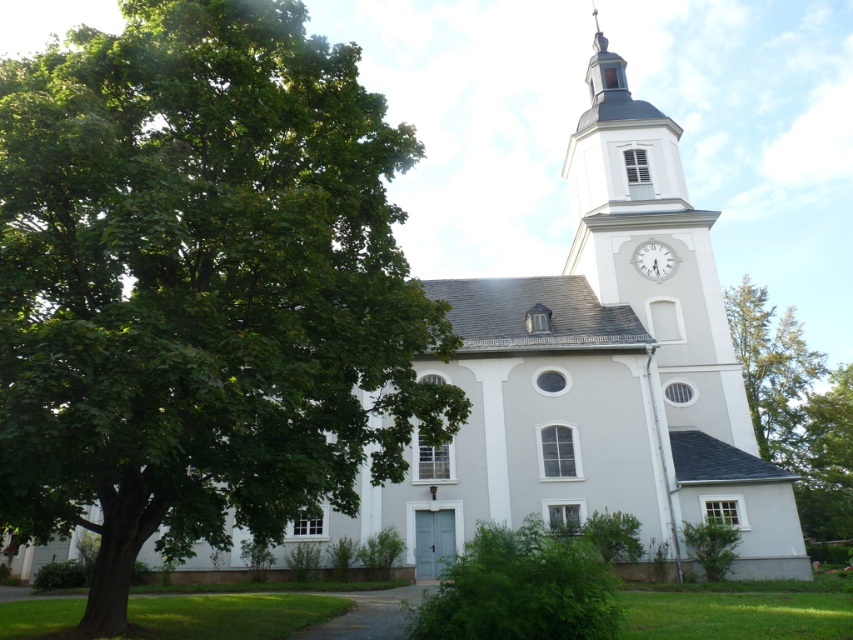
You are standing in front of the church and notice two structures at the top of the clock tower. One is a smooth gray spire at upper center and the other is a white glossy clock at upper center. Which one is positioned to the right?

The smooth gray spire at upper center is to the right of the white glossy clock at upper center.

You are standing in front of the church and want to take a photo that includes both the green leafy tree at right and the smooth gray spire at upper center. Which object will occupy more space in the photo?

The green leafy tree at right will occupy more space in the photo because its width is larger than the smooth gray spire at upper center.

You are standing in front of the white church and want to take a photo of the smooth gray spire at upper center without the green leafy tree at right blocking the view. Is the tree shorter than the spire?

The green leafy tree at right is shorter than the smooth gray spire at upper center, so the tree will not block the view of the spire in your photo.